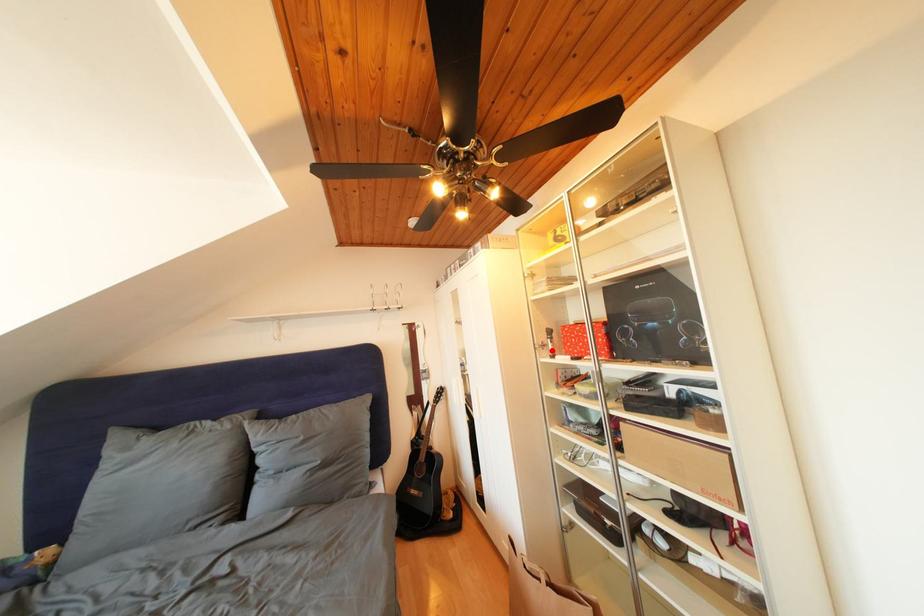
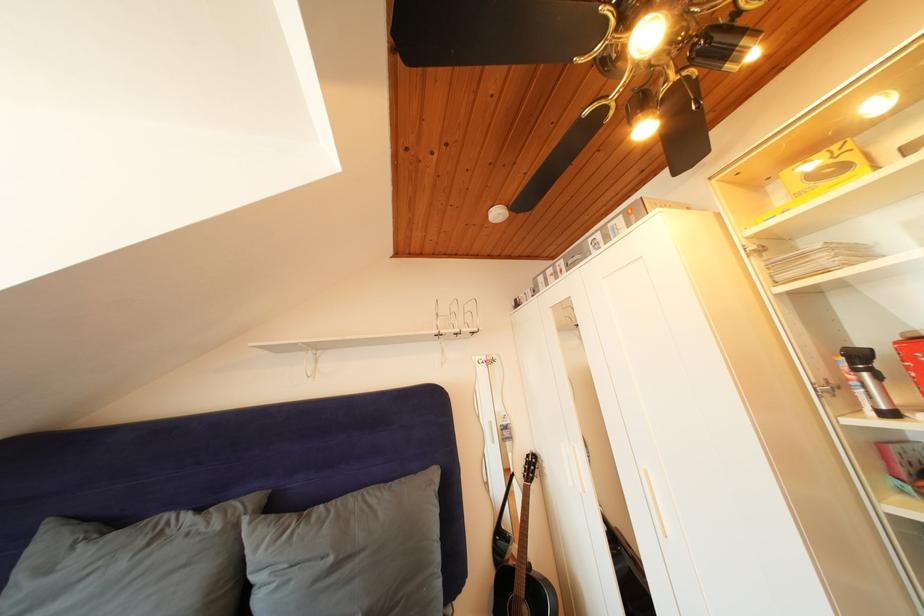
Locate, in the second image, the point that corresponds to the highlighted location in the first image.

(844, 392)